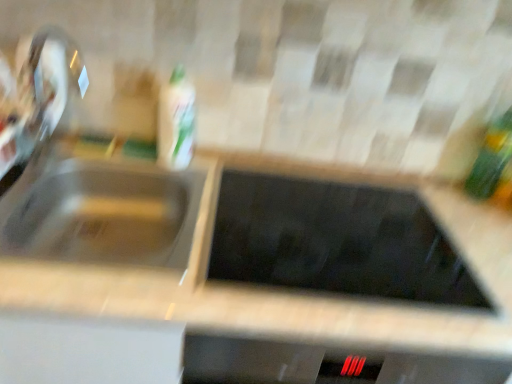
Where is `vacant area that lies in front of green glass bottle at right, the 2th bottle positioned from the left`? The width and height of the screenshot is (512, 384). vacant area that lies in front of green glass bottle at right, the 2th bottle positioned from the left is located at coordinates (470, 228).